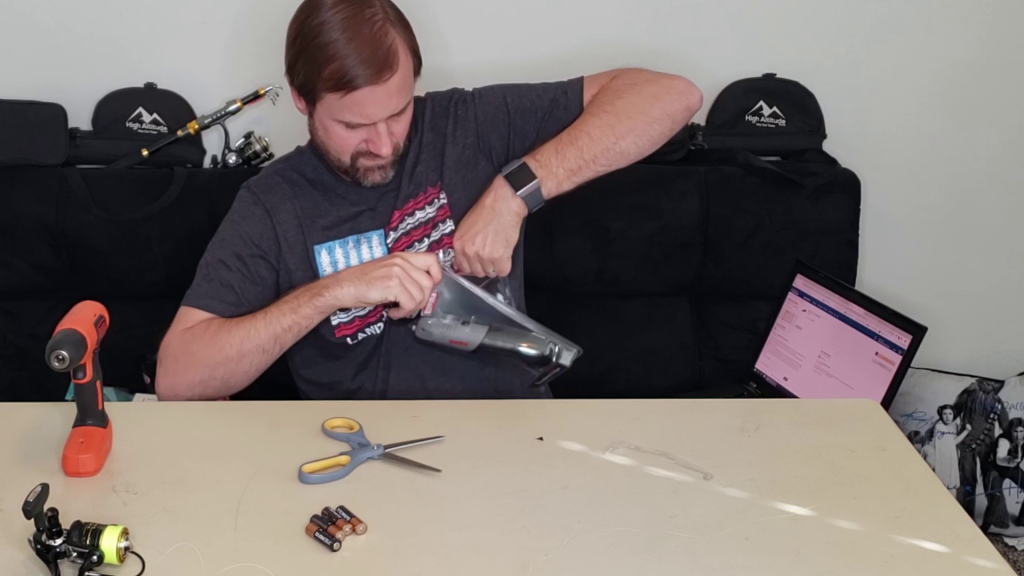
Where is `stapler`? stapler is located at coordinates (469, 329).